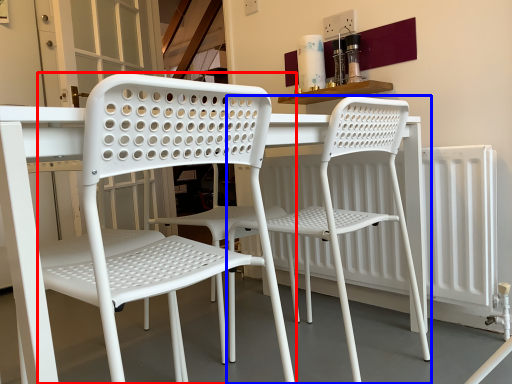
Question: Which object is further to the camera taking this photo, chair (highlighted by a red box) or chair (highlighted by a blue box)?

Choices:
 (A) chair
 (B) chair

Answer: (B)